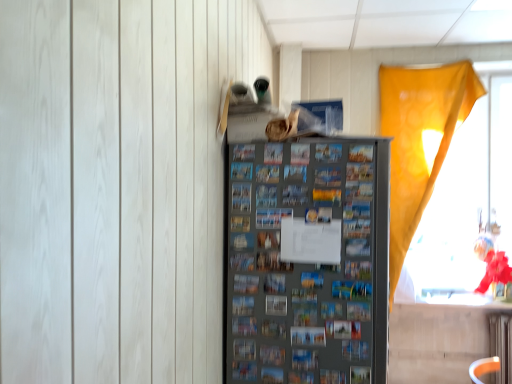
What is the approximate width of metallic gray fridge at center?

metallic gray fridge at center is 24.52 inches in width.

Where is `metallic gray fridge at center`? metallic gray fridge at center is located at coordinates (308, 262).

Describe the element at coordinates (308, 262) in the screenshot. I see `metallic gray fridge at center` at that location.

Measure the distance between metallic gray fridge at center and camera.

metallic gray fridge at center is 1.46 meters from camera.

Describe the element at coordinates (460, 176) in the screenshot. This screenshot has width=512, height=384. I see `translucent yellow curtain at right` at that location.

This screenshot has height=384, width=512. Identify the location of translucent yellow curtain at right. (460, 176).

Identify the location of metallic gray fridge at center. Image resolution: width=512 pixels, height=384 pixels. (308, 262).

Between translucent yellow curtain at right and metallic gray fridge at center, which one appears on the right side from the viewer's perspective?

translucent yellow curtain at right.

In the image, is translucent yellow curtain at right positioned in front of or behind metallic gray fridge at center?

Visually, translucent yellow curtain at right is located behind metallic gray fridge at center.

Which is behind, point (431, 114) or point (368, 373)?

The point (431, 114) is farther from the camera.

From the image's perspective, who appears lower, translucent yellow curtain at right or metallic gray fridge at center?

From the image's view, metallic gray fridge at center is below.

From a real-world perspective, is translucent yellow curtain at right located beneath metallic gray fridge at center?

Incorrect, from a real-world perspective, translucent yellow curtain at right is higher than metallic gray fridge at center.

Looking at their sizes, would you say translucent yellow curtain at right is wider or thinner than metallic gray fridge at center?

Considering their sizes, translucent yellow curtain at right looks slimmer than metallic gray fridge at center.

Does translucent yellow curtain at right have a lesser height compared to metallic gray fridge at center?

No.

From the picture: Considering the relative sizes of translucent yellow curtain at right and metallic gray fridge at center in the image provided, is translucent yellow curtain at right smaller than metallic gray fridge at center?

Correct, translucent yellow curtain at right occupies less space than metallic gray fridge at center.

Would you say translucent yellow curtain at right contains metallic gray fridge at center?

No, metallic gray fridge at center is not a part of translucent yellow curtain at right.

Can you see translucent yellow curtain at right touching metallic gray fridge at center?

They are not placed beside each other.

Could you tell me if translucent yellow curtain at right is facing metallic gray fridge at center?

No, translucent yellow curtain at right is not oriented towards metallic gray fridge at center.

Find the location of a particular element. The image size is (512, 384). window behind the metallic gray fridge at center is located at coordinates (460, 176).

Between metallic gray fridge at center and translucent yellow curtain at right, which one appears on the left side from the viewer's perspective?

From the viewer's perspective, metallic gray fridge at center appears more on the left side.

Is the depth of metallic gray fridge at center less than that of translucent yellow curtain at right?

Yes, the depth of metallic gray fridge at center is less than that of translucent yellow curtain at right.

Is point (256, 326) positioned in front of point (429, 255)?

Yes, it is in front of point (429, 255).

From the image's perspective, between metallic gray fridge at center and translucent yellow curtain at right, which one is located above?

From the image's view, translucent yellow curtain at right is above.

From a real-world perspective, who is located higher, metallic gray fridge at center or translucent yellow curtain at right?

In real-world perspective, translucent yellow curtain at right is above.

Is metallic gray fridge at center thinner than translucent yellow curtain at right?

In fact, metallic gray fridge at center might be wider than translucent yellow curtain at right.

Can you confirm if metallic gray fridge at center is taller than translucent yellow curtain at right?

No, metallic gray fridge at center is not taller than translucent yellow curtain at right.

Does metallic gray fridge at center have a larger size compared to translucent yellow curtain at right?

Correct, metallic gray fridge at center is larger in size than translucent yellow curtain at right.

Is metallic gray fridge at center spatially inside translucent yellow curtain at right, or outside of it?

metallic gray fridge at center exists outside the volume of translucent yellow curtain at right.

Is metallic gray fridge at center beside translucent yellow curtain at right?

They are not placed beside each other.

Is metallic gray fridge at center facing towards translucent yellow curtain at right?

No, metallic gray fridge at center is not facing towards translucent yellow curtain at right.

How far apart are metallic gray fridge at center and translucent yellow curtain at right?

metallic gray fridge at center is 5.71 feet from translucent yellow curtain at right.

Locate an element on the screen. shelf to the left of translucent yellow curtain at right is located at coordinates (308, 262).

Locate an element on the screen. The height and width of the screenshot is (384, 512). window above the metallic gray fridge at center (from the image's perspective) is located at coordinates pos(460,176).

You are a GUI agent. You are given a task and a screenshot of the screen. Output one action in this format:
    pyautogui.click(x=<x>, y=<y>)
    Task: Click on the shelf below the translucent yellow curtain at right (from the image's perspective)
    This screenshot has height=384, width=512.
    Given the screenshot: What is the action you would take?
    pyautogui.click(x=308, y=262)